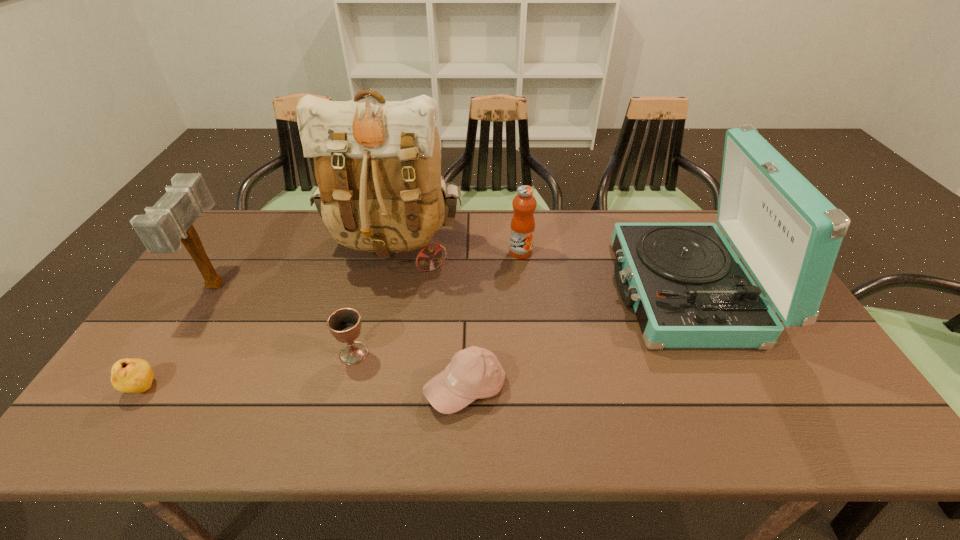
Image resolution: width=960 pixels, height=540 pixels. In order to click on backpack in this screenshot , I will do `click(377, 164)`.

The width and height of the screenshot is (960, 540). What are the coordinates of `the rightmost object` in the screenshot? It's located at [x=688, y=288].

This screenshot has width=960, height=540. Identify the location of record player. (688, 288).

The width and height of the screenshot is (960, 540). Identify the location of the fifth shortest object. (169, 222).

You are a GUI agent. You are given a task and a screenshot of the screen. Output one action in this format:
    pyautogui.click(x=<x>, y=<y>)
    Task: Click on the sixth object from left to right
    This screenshot has width=960, height=540.
    Given the screenshot: What is the action you would take?
    pyautogui.click(x=522, y=229)

Find the location of a particular element. fruit juice is located at coordinates (522, 229).

I want to click on the fifth tallest object, so click(x=344, y=324).

This screenshot has width=960, height=540. I want to click on pear, so click(128, 375).

Locate an element on the screen. Image resolution: width=960 pixels, height=540 pixels. baseball cap is located at coordinates pyautogui.click(x=474, y=373).

Find the location of a particular element. The image size is (960, 540). blank space located 0.320m on the front-facing side of the backpack is located at coordinates (366, 380).